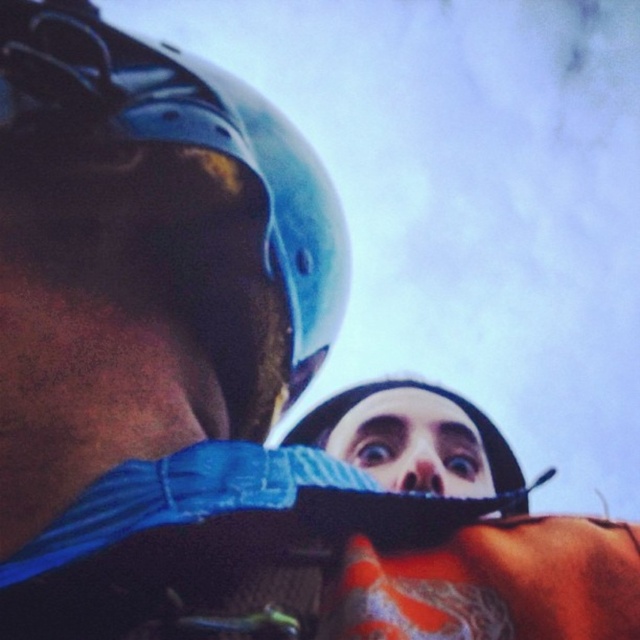
Question: Is blue matte helmet at upper left below smooth skin face at center?

Choices:
 (A) yes
 (B) no

Answer: (B)

Question: Which point is closer to the camera?

Choices:
 (A) smooth skin face at center
 (B) blue matte helmet at upper left

Answer: (B)

Question: Which point is farther from the camera taking this photo?

Choices:
 (A) (244, 365)
 (B) (342, 444)

Answer: (B)

Question: Does blue matte helmet at upper left appear under smooth skin face at center?

Choices:
 (A) no
 (B) yes

Answer: (A)

Question: Is blue matte helmet at upper left closer to camera compared to smooth skin face at center?

Choices:
 (A) yes
 (B) no

Answer: (A)